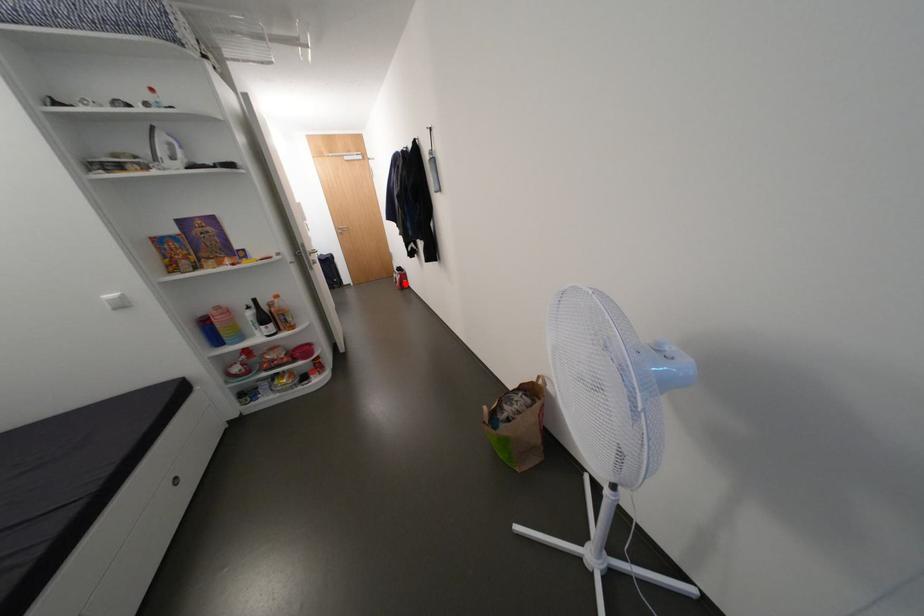
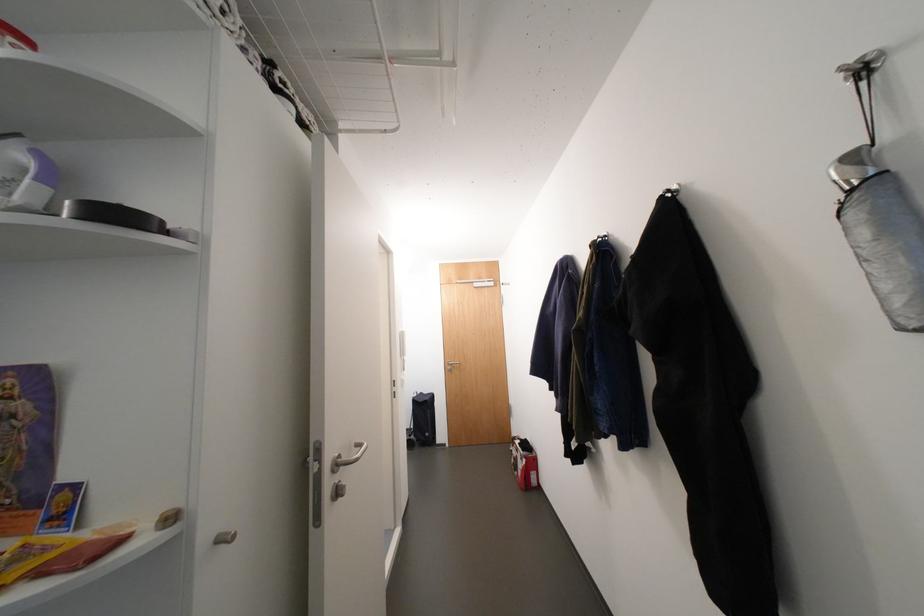
Locate, in the second image, the point that corresponds to the highlighted location in the first image.

(527, 474)